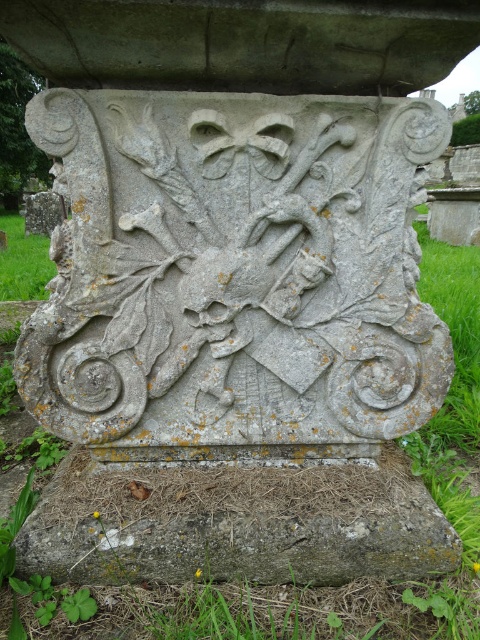
Question: Which object is closer to the camera taking this photo?

Choices:
 (A) green grass at center
 (B) gray stone base at center

Answer: (A)

Question: Which is nearer to the gray stone shield at center?

Choices:
 (A) green grass at center
 (B) gray stone base at center

Answer: (B)

Question: Is gray stone shield at center behind gray stone base at center?

Choices:
 (A) no
 (B) yes

Answer: (A)

Question: Where is gray stone base at center located in relation to green grass at center in the image?

Choices:
 (A) right
 (B) left

Answer: (B)

Question: Estimate the real-world distances between objects in this image. Which object is farther from the green grass at center?

Choices:
 (A) green grass at lower left
 (B) gray stone base at center

Answer: (A)

Question: Can you confirm if gray stone shield at center is positioned to the right of green grass at center?

Choices:
 (A) yes
 (B) no

Answer: (B)